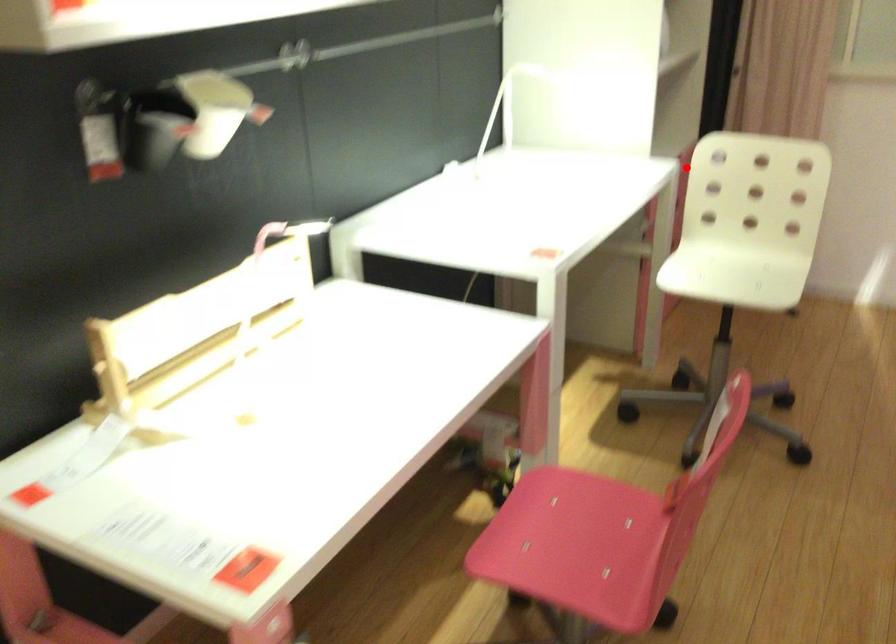
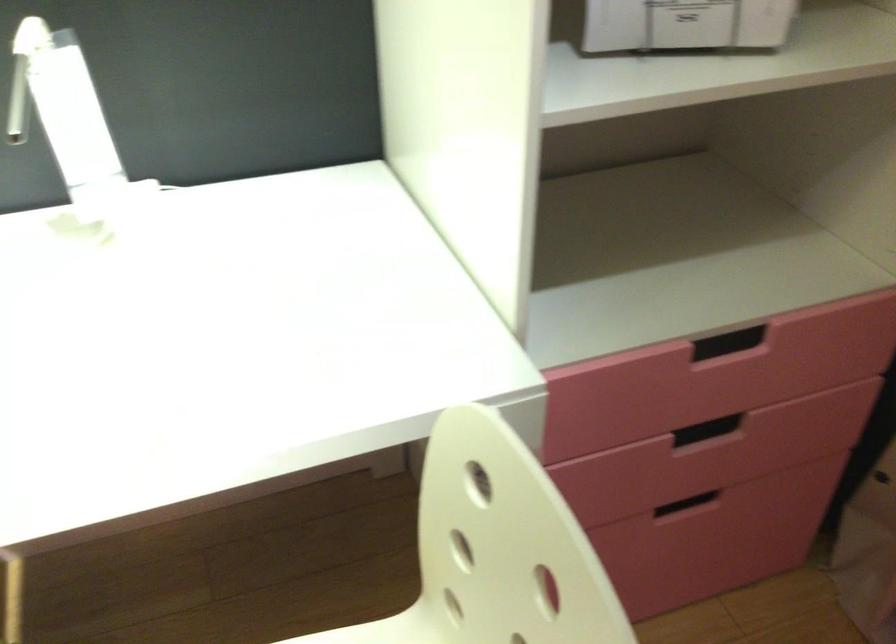
Question: I am providing you with two images of the same scene from different viewpoints. Given a red point in image1, look at the same physical point in image2. Is it:

Choices:
 (A) Closer to the viewpoint
 (B) Farther from the viewpoint

Answer: (A)